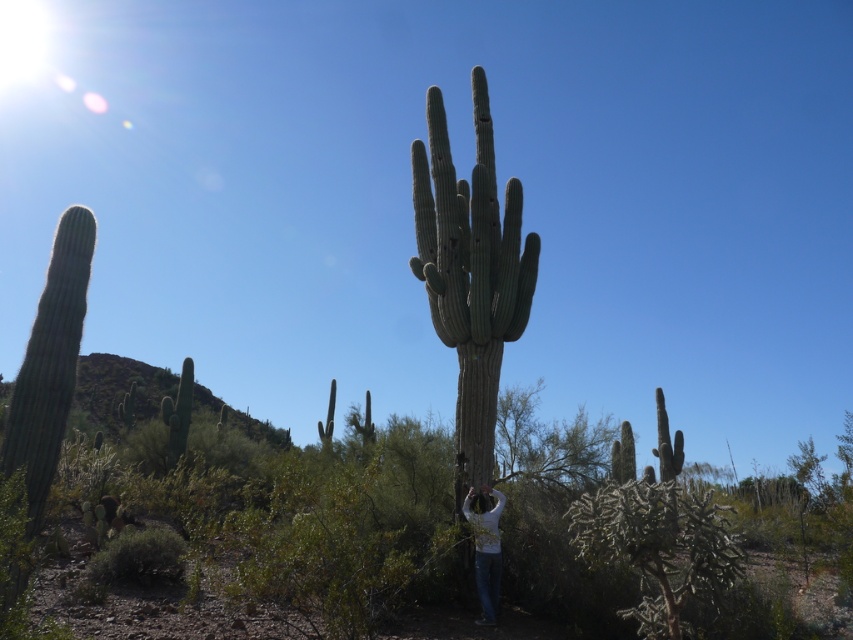
Which is in front, point (521, 292) or point (498, 515)?

Point (498, 515) is more forward.

Is green spiny cactus at center above white matte shirt at center?

Yes, green spiny cactus at center is above white matte shirt at center.

What do you see at coordinates (469, 273) in the screenshot? I see `green spiny cactus at center` at bounding box center [469, 273].

Locate an element on the screen. green spiny cactus at center is located at coordinates (469, 273).